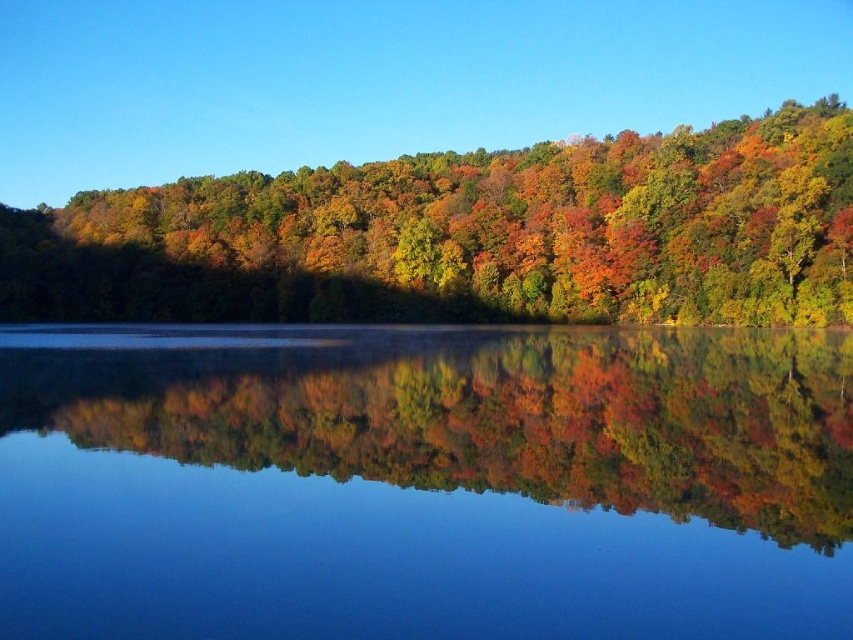
Is smooth glass water at center further to the viewer compared to autumn leaves at center?

No, smooth glass water at center is in front of autumn leaves at center.

In the scene shown: Between smooth glass water at center and autumn leaves at center, which one appears on the right side from the viewer's perspective?

smooth glass water at center is more to the right.

Image resolution: width=853 pixels, height=640 pixels. What are the coordinates of `smooth glass water at center` in the screenshot? It's located at (424, 483).

The height and width of the screenshot is (640, 853). I want to click on smooth glass water at center, so (424, 483).